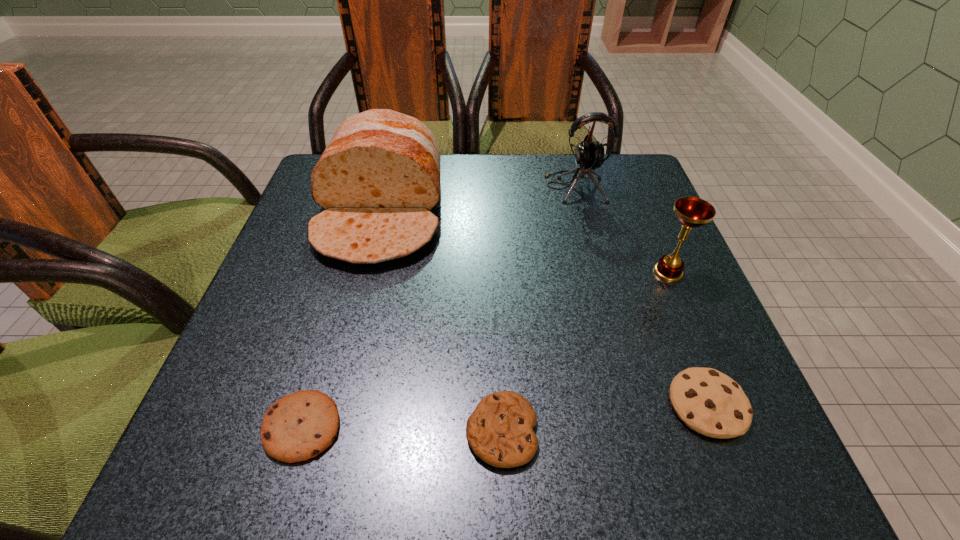
Identify the location of earphone. Image resolution: width=960 pixels, height=540 pixels. (589, 156).

Where is `bread`? bread is located at coordinates (378, 179).

I want to click on chalice, so click(692, 212).

Find the location of a particular element. This screenshot has height=540, width=960. the rightmost cookie is located at coordinates (709, 402).

Where is `the third shortest object`? The image size is (960, 540). the third shortest object is located at coordinates (709, 402).

You are a GUI agent. You are given a task and a screenshot of the screen. Output one action in this format:
    pyautogui.click(x=<x>, y=<y>)
    Task: Click on the leftmost cookie
    This screenshot has width=960, height=540.
    Given the screenshot: What is the action you would take?
    pyautogui.click(x=297, y=427)

Where is `the fourth object from right to left`? The height and width of the screenshot is (540, 960). the fourth object from right to left is located at coordinates (500, 432).

This screenshot has height=540, width=960. In order to click on vacant space located 0.090m on the left of the earphone in this screenshot , I will do `click(508, 187)`.

In order to click on vacant space located 0.270m at the sliced end of the bread in this screenshot , I will do `click(333, 400)`.

The height and width of the screenshot is (540, 960). Identify the location of vacant space located 0.050m on the back of the chalice. (656, 244).